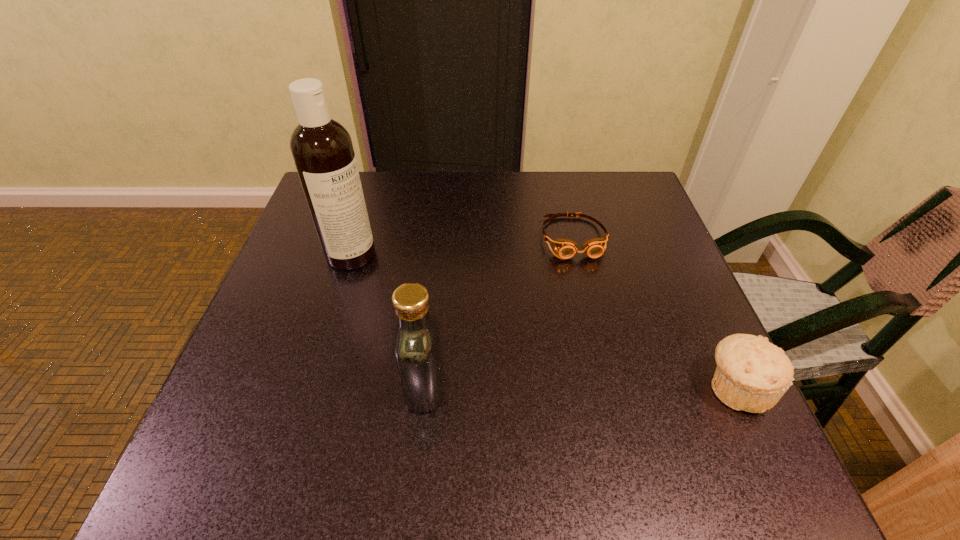
Where is `vacant area that lies between the dishwasher detergent and the second shortest object`? vacant area that lies between the dishwasher detergent and the second shortest object is located at coordinates (543, 321).

At what (x,y) coordinates should I click in order to perform the action: click on vacant space that is in between the dishwasher detergent and the third shortest object. Please return your answer as a coordinate pair (x, y). This screenshot has height=540, width=960. Looking at the image, I should click on (388, 321).

Locate an element on the screen. Image resolution: width=960 pixels, height=540 pixels. free space that is in between the muffin and the vodka is located at coordinates (580, 387).

Locate an element on the screen. The width and height of the screenshot is (960, 540). the second closest object to the dishwasher detergent is located at coordinates (565, 248).

At what (x,y) coordinates should I click in order to perform the action: click on the second closest object relative to the second tallest object. Please return your answer as a coordinate pair (x, y). This screenshot has width=960, height=540. Looking at the image, I should click on (565, 248).

Locate an element on the screen. The width and height of the screenshot is (960, 540). free space that satisfies the following two spatial constraints: 1. on the front side of the shortest object; 2. on the left side of the third tallest object is located at coordinates (608, 388).